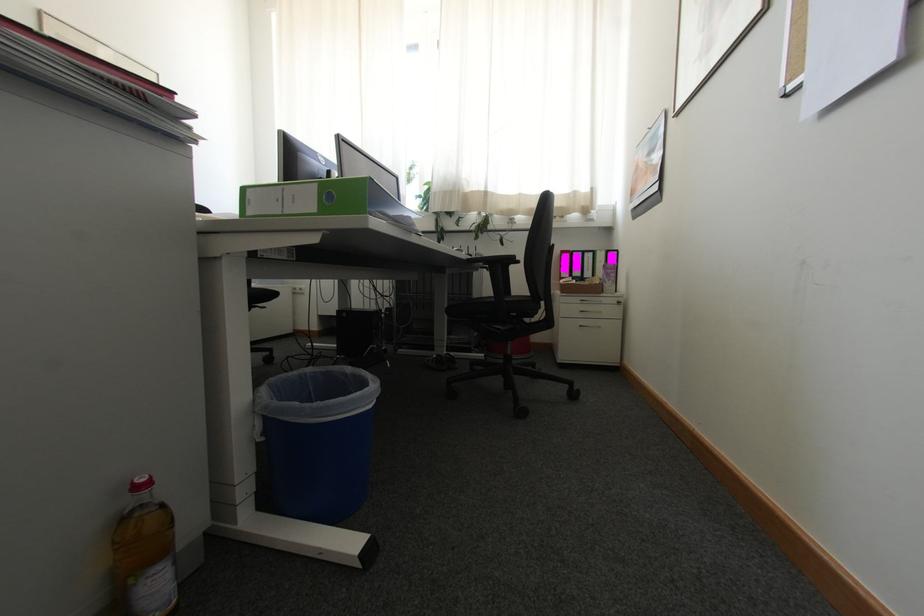
Describe the element at coordinates (492, 309) in the screenshot. I see `the chair sitting surface` at that location.